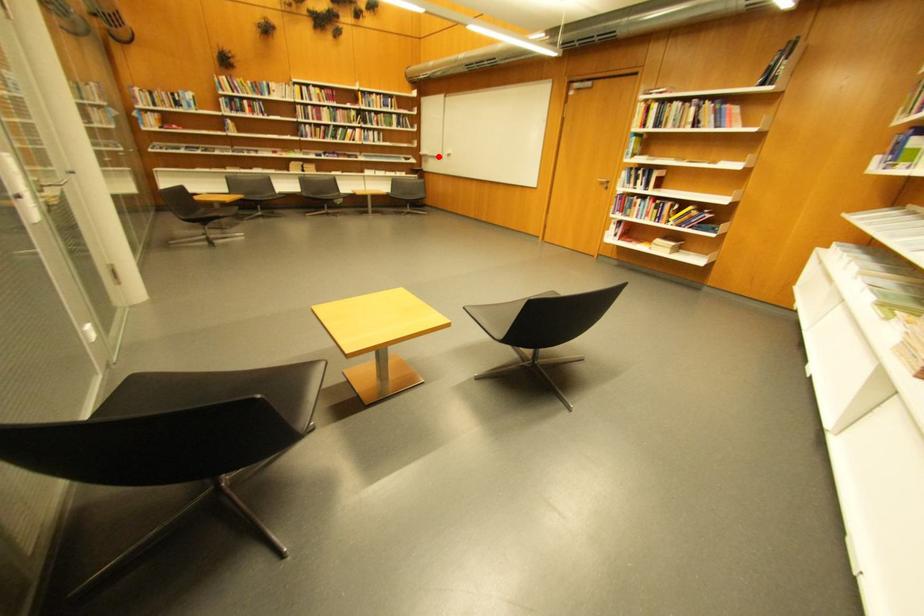
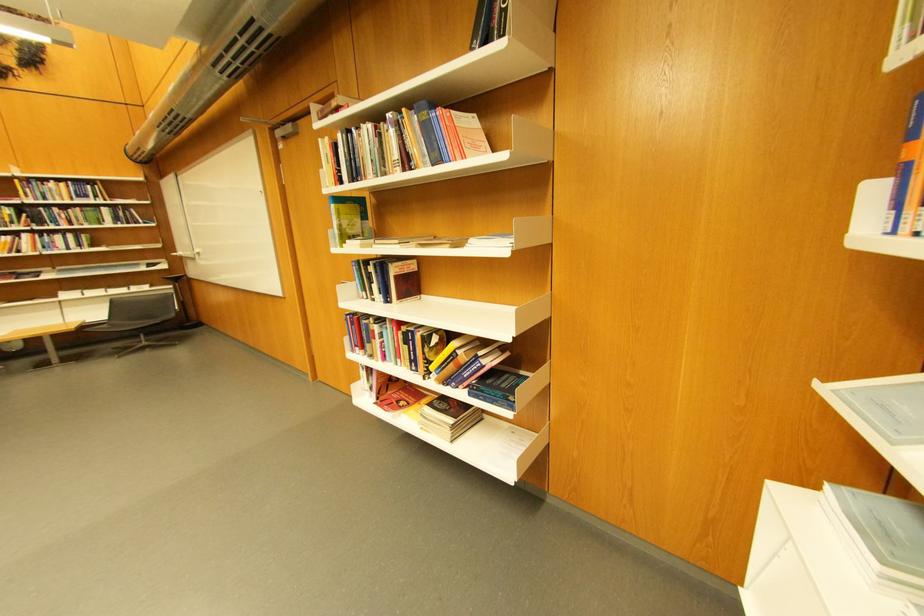
Question: I am providing you with two images of the same scene from different viewpoints. Image1 has a red point marked. In image2, the corresponding 3D location appears at what relative position? Reply with the corresponding letter.

Choices:
 (A) Closer
 (B) Farther

Answer: (B)